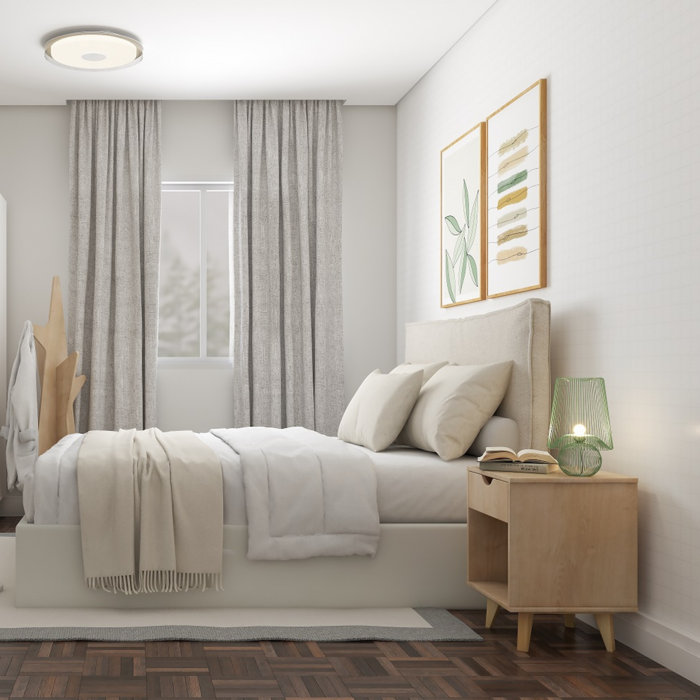
Locate an element on the screen. modern glass lamp is located at coordinates (593, 467), (567, 456), (554, 441), (606, 427), (596, 383), (563, 383), (580, 427).